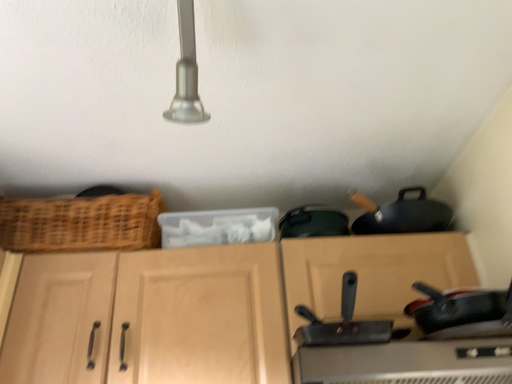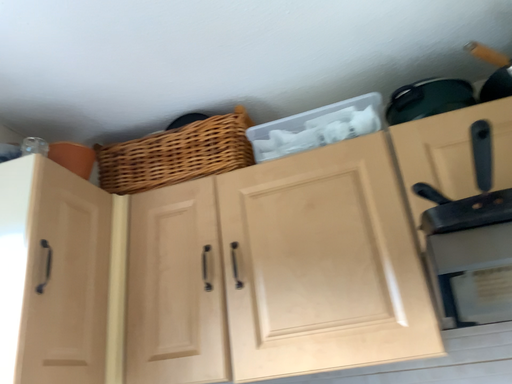
Question: Which way did the camera rotate in the video?

Choices:
 (A) rotated right
 (B) rotated left

Answer: (B)